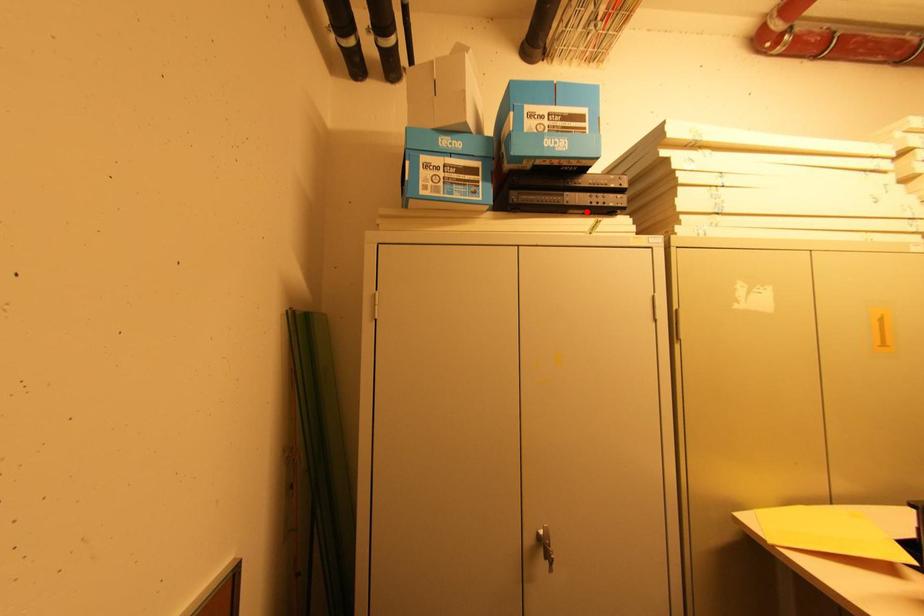
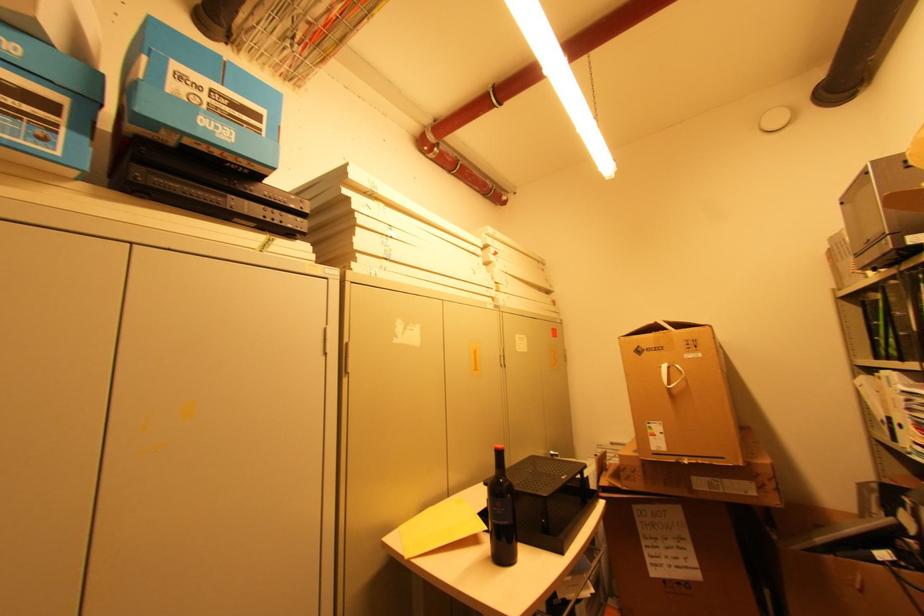
Where in the second image is the point corresponding to the highlighted location from the first image?

(258, 225)